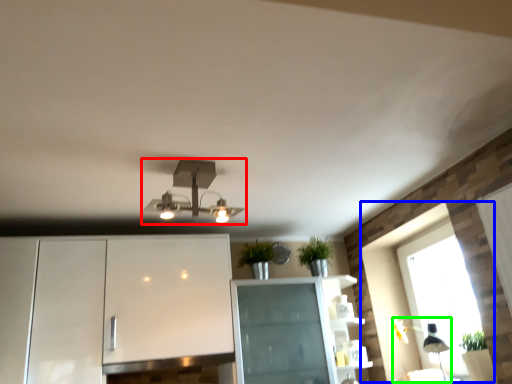
Question: Which is farther away from lamp (highlighted by a red box)? window (highlighted by a blue box) or light fixture (highlighted by a green box)?

Choices:
 (A) window
 (B) light fixture

Answer: (B)